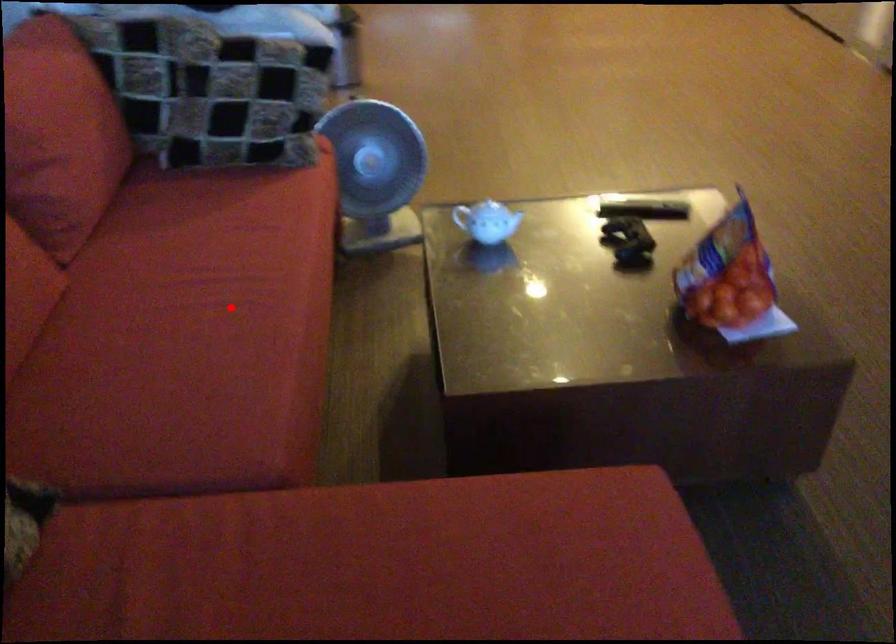
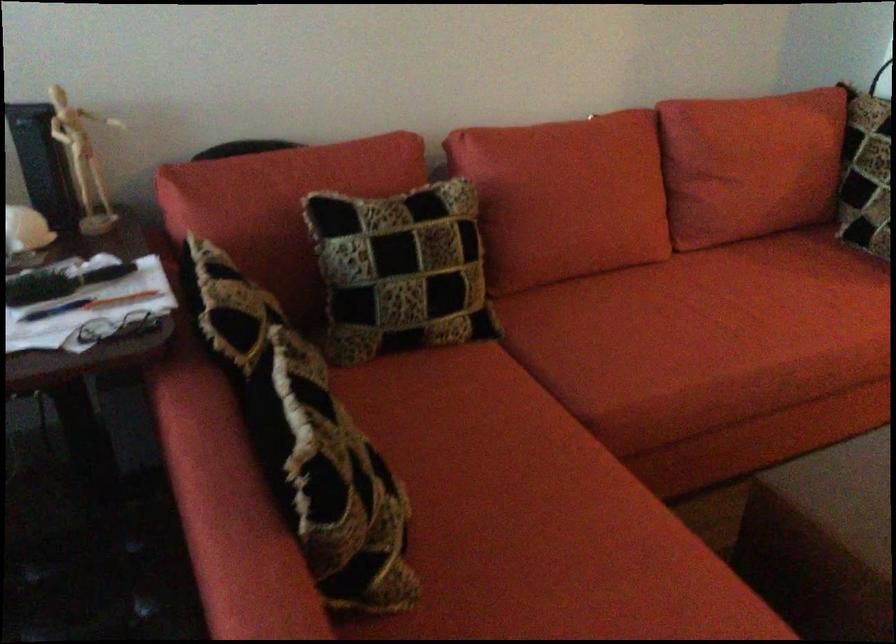
Question: I am providing you with two images of the same scene from different viewpoints. Given a red point in image1, look at the same physical point in image2. Is it:

Choices:
 (A) Closer to the viewpoint
 (B) Farther from the viewpoint

Answer: (B)